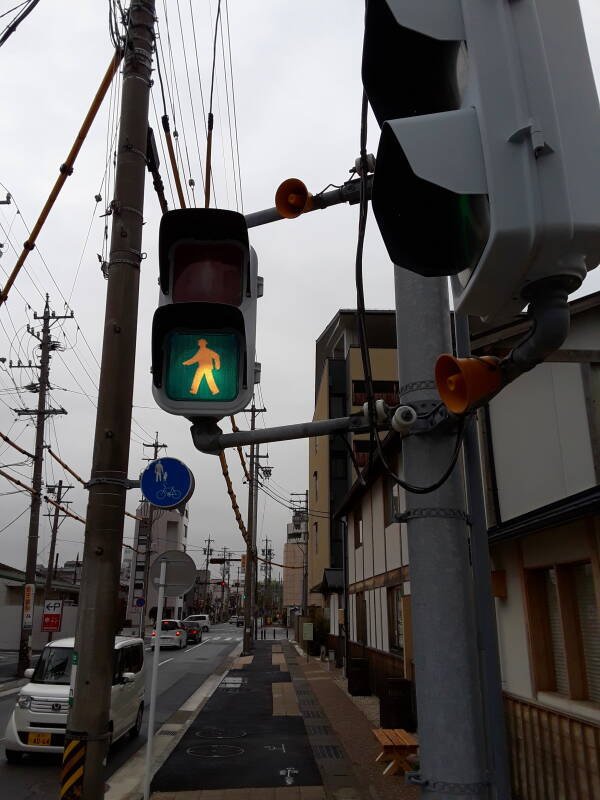
Identify the location of light. (203, 362).